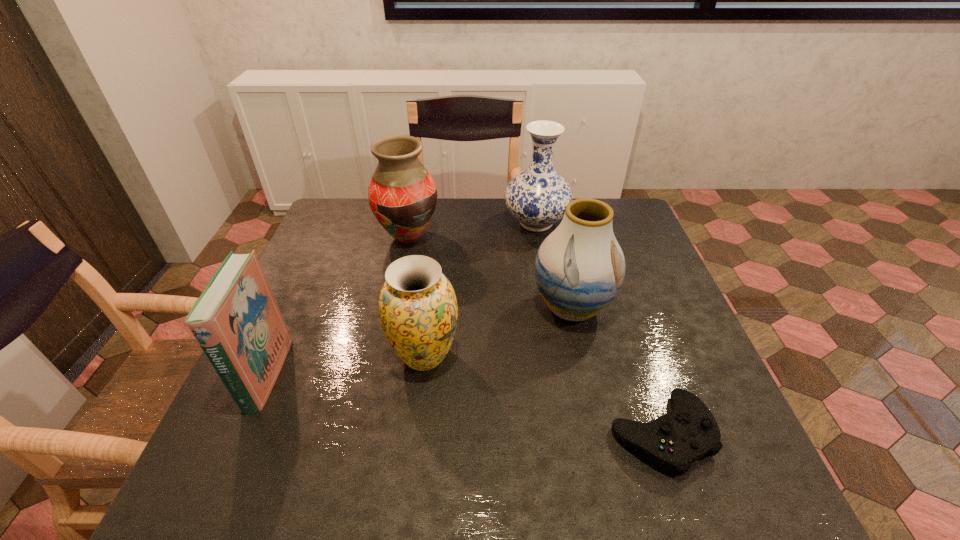
Image resolution: width=960 pixels, height=540 pixels. I want to click on vacant space at the far edge, so click(x=506, y=235).

In the image, there is a desktop. Where is `vacant space at the left edge`? Image resolution: width=960 pixels, height=540 pixels. vacant space at the left edge is located at coordinates (288, 302).

Locate an element on the screen. This screenshot has width=960, height=540. vacant space at the right edge of the desktop is located at coordinates (x=659, y=358).

The image size is (960, 540). In the image, there is a desktop. What are the coordinates of `free region at the far right corner` in the screenshot? It's located at (618, 219).

This screenshot has width=960, height=540. In order to click on vacant space at the near right corner in this screenshot , I will do `click(768, 507)`.

The height and width of the screenshot is (540, 960). Find the location of `vacant space that is in between the shortest object and the shortest vase`. vacant space that is in between the shortest object and the shortest vase is located at coordinates (542, 395).

Locate which object is the fifth closest to the shortest vase. Please provide its 2D coordinates. Your answer should be formatted as a tuple, i.e. [(x, y)], where the tuple contains the x and y coordinates of a point satisfying the conditions above.

[(537, 197)]

Locate an element on the screen. object identified as the fifth closest to the shortest object is located at coordinates (236, 321).

Identify which vase is the second closest to the leftmost object. Please provide its 2D coordinates. Your answer should be formatted as a tuple, i.e. [(x, y)], where the tuple contains the x and y coordinates of a point satisfying the conditions above.

[(402, 195)]

You are a GUI agent. You are given a task and a screenshot of the screen. Output one action in this format:
    pyautogui.click(x=<x>, y=<y>)
    Task: Click on the vase that stands as the third closest to the leftmost object
    
    Given the screenshot: What is the action you would take?
    pyautogui.click(x=579, y=268)